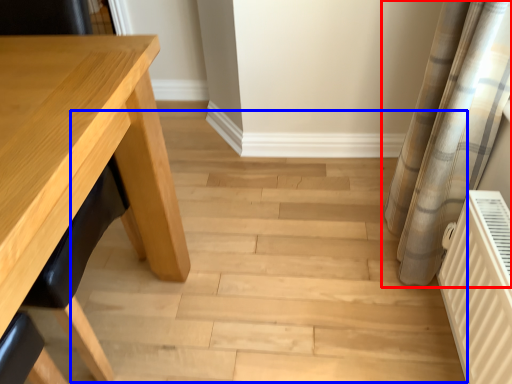
Question: Which object is further to the camera taking this photo, curtain (highlighted by a red box) or stair (highlighted by a blue box)?

Choices:
 (A) curtain
 (B) stair

Answer: (B)